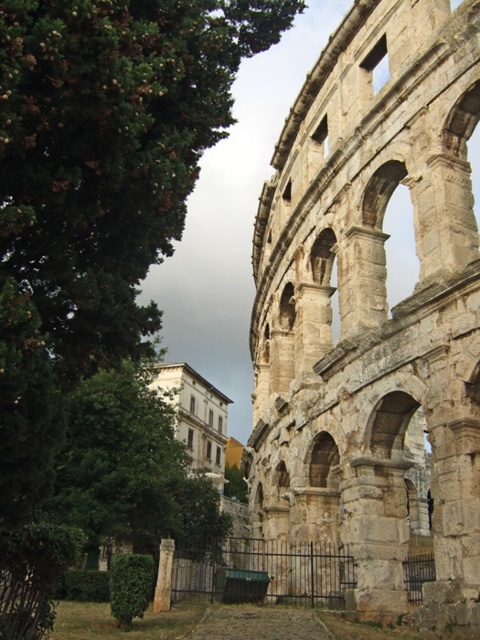
What do you see at coordinates (372, 307) in the screenshot? I see `stone arches at right` at bounding box center [372, 307].

Based on the photo, does stone arches at right have a greater height compared to smooth stone pillar at center?

Yes, stone arches at right is taller than smooth stone pillar at center.

Which is behind, point (267, 400) or point (156, 596)?

The point (267, 400) is behind.

Image resolution: width=480 pixels, height=640 pixels. What are the coordinates of `stone arches at right` in the screenshot? It's located at (372, 307).

Is point (8, 13) in front of point (61, 516)?

Yes, it is in front of point (61, 516).

In the scene shown: Is green leafy tree at upper left smaller than green leafy tree at center?

Yes, green leafy tree at upper left is smaller than green leafy tree at center.

Is point (31, 184) positioned after point (100, 372)?

That is False.

Locate an element on the screen. green leafy tree at upper left is located at coordinates (97, 188).

Between green leafy tree at upper left and smooth stone pillar at center, which one is positioned lower?

smooth stone pillar at center is lower down.

From the picture: Can you confirm if green leafy tree at upper left is positioned to the left of smooth stone pillar at center?

Correct, you'll find green leafy tree at upper left to the left of smooth stone pillar at center.

Locate an element on the screen. This screenshot has height=640, width=480. green leafy tree at upper left is located at coordinates (97, 188).